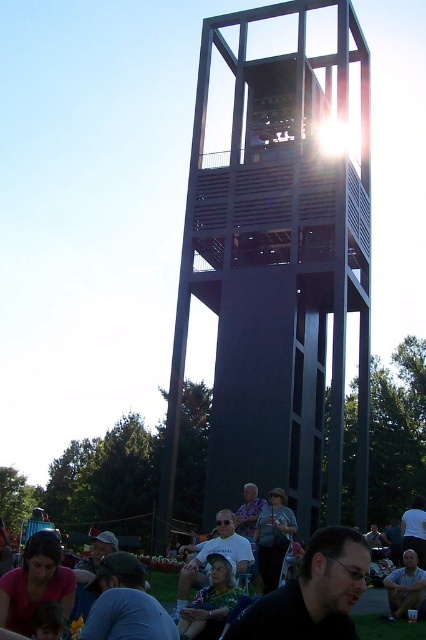
Question: From the image, what is the correct spatial relationship of black metal observation tower at center in relation to light brown leather jacket at lower right?

Choices:
 (A) left
 (B) right

Answer: (A)

Question: Is black metal observation tower at center thinner than black matte shirt at lower center?

Choices:
 (A) yes
 (B) no

Answer: (B)

Question: Which point appears closest to the camera in this image?

Choices:
 (A) (273, 310)
 (B) (68, 604)

Answer: (B)

Question: Can you confirm if black metal observation tower at center is positioned to the right of black matte shirt at lower center?

Choices:
 (A) no
 (B) yes

Answer: (B)

Question: Which of the following is the closest to the observer?

Choices:
 (A) black matte shirt at lower center
 (B) matte gray shirt at center
 (C) floral fabric dress at lower center

Answer: (A)

Question: Which of these objects is positioned farthest from the black matte shirt at lower center?

Choices:
 (A) floral fabric dress at lower center
 (B) black metal observation tower at center
 (C) matte black chairs at lower center

Answer: (B)